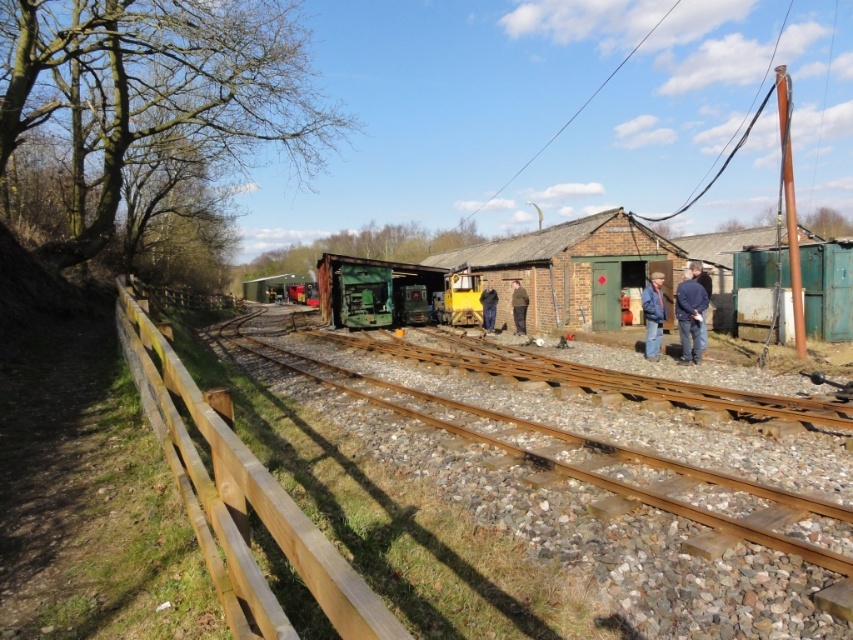
Between point (698, 259) and point (654, 285), which one is positioned in front?

Point (654, 285) is more forward.

Is rusty green hut at right positioned before blue denim jacket at center?

No, rusty green hut at right is further to the viewer.

What do you see at coordinates (724, 264) in the screenshot? The height and width of the screenshot is (640, 853). I see `rusty green hut at right` at bounding box center [724, 264].

This screenshot has height=640, width=853. I want to click on rusty green hut at right, so click(724, 264).

Which is below, brown brick hut at center or brown leather jacket at center?

brown leather jacket at center

Looking at this image, does brown brick hut at center appear under brown leather jacket at center?

Incorrect, brown brick hut at center is not positioned below brown leather jacket at center.

Who is more distant from viewer, (552, 228) or (521, 307)?

Point (552, 228)

Find the location of `brown brick hut at center`. brown brick hut at center is located at coordinates (573, 268).

Find the location of a particular element. The width and height of the screenshot is (853, 640). rusty metal train track at center is located at coordinates (573, 452).

Is rusty metal train track at center behind blue denim jacket at center?

That is False.

Measure the distance between point (718, 480) and camera.

Point (718, 480) and camera are 5.84 meters apart.

Find the location of a particular element. This screenshot has height=640, width=853. rusty metal train track at center is located at coordinates point(573,452).